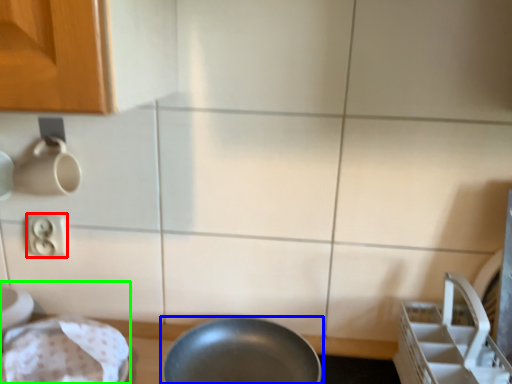
Question: Considering the real-world distances, which object is farthest from electric outlet (highlighted by a red box)? frying pan (highlighted by a blue box) or sink (highlighted by a green box)?

Choices:
 (A) frying pan
 (B) sink

Answer: (A)